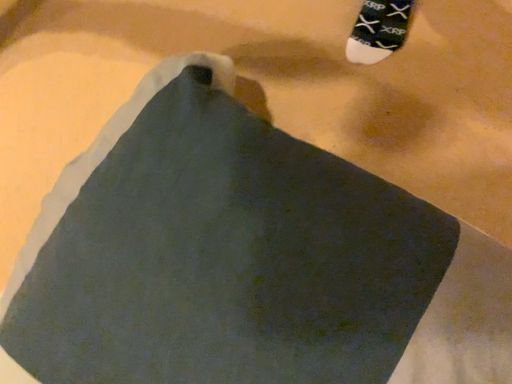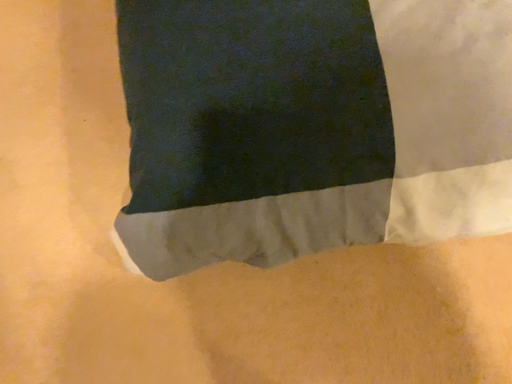
Question: How did the camera likely rotate when shooting the video?

Choices:
 (A) rotated downward
 (B) rotated upward

Answer: (B)